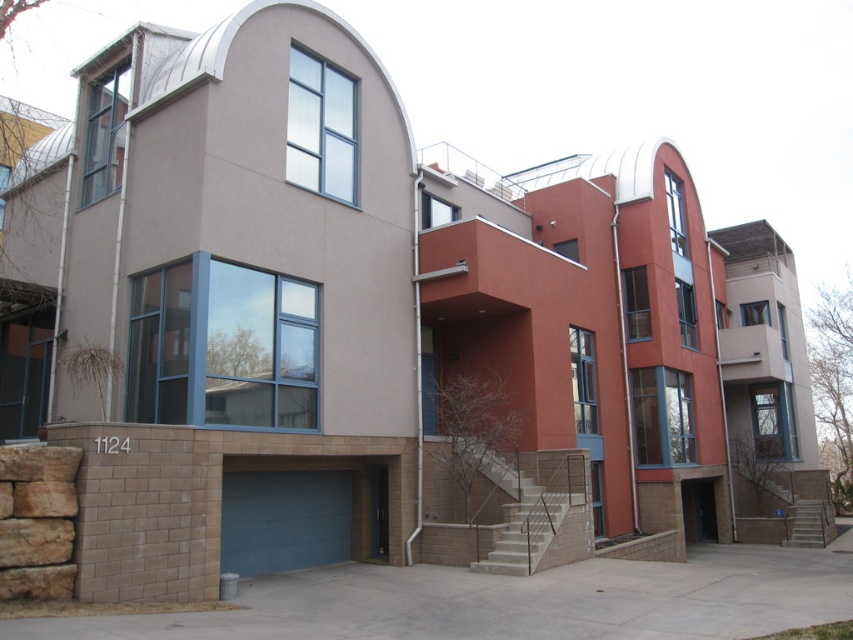
Is white concrete stairs at center further to camera compared to smooth concrete stairs at lower right?

No, white concrete stairs at center is in front of smooth concrete stairs at lower right.

Which is in front, point (556, 451) or point (793, 541)?

Point (556, 451) is more forward.

Between point (532, 531) and point (793, 504), which one is positioned behind?

Point (793, 504)

This screenshot has width=853, height=640. I want to click on white concrete stairs at center, so click(x=544, y=516).

Is blue matte garage door at lower left further to camera compared to smooth concrete stairs at lower right?

That is False.

Who is more forward, (296, 497) or (792, 529)?

Point (296, 497)

Where is `blue matte garage door at lower left`? The image size is (853, 640). blue matte garage door at lower left is located at coordinates pyautogui.click(x=283, y=520).

Who is shorter, blue matte garage door at lower left or white concrete stairs at center?

white concrete stairs at center

Locate an element on the screen. This screenshot has width=853, height=640. blue matte garage door at lower left is located at coordinates [x=283, y=520].